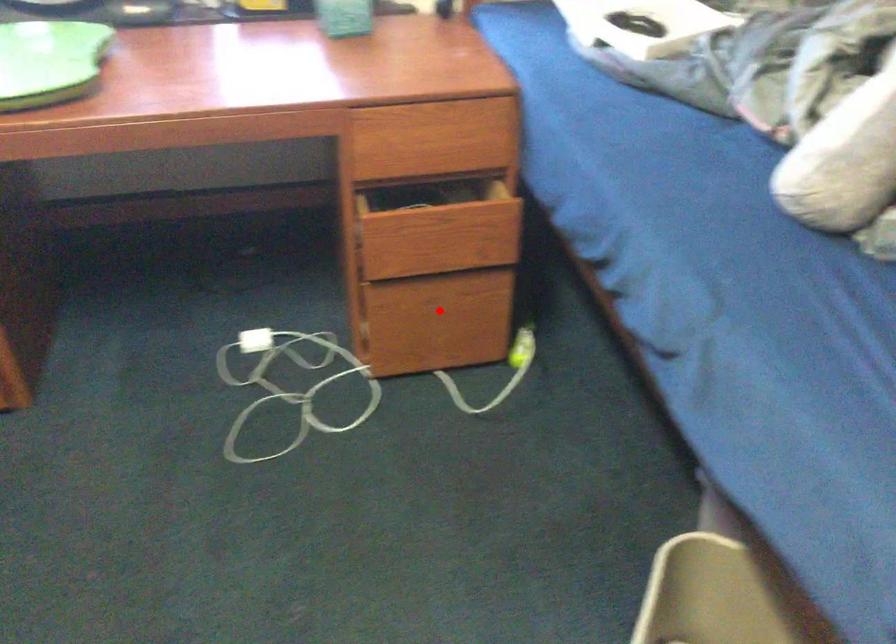
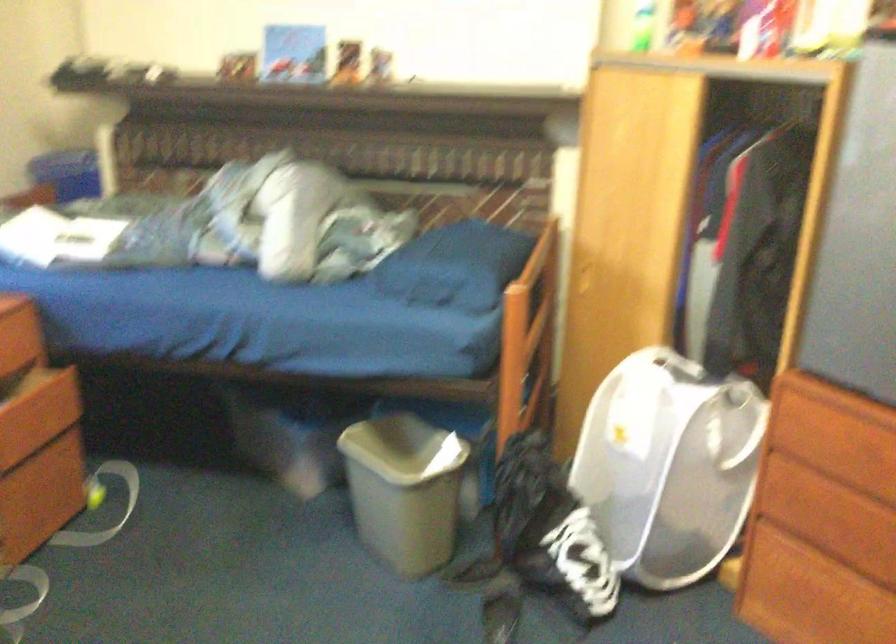
Where in the second image is the point corresponding to the highlighted location from the first image?

(39, 482)